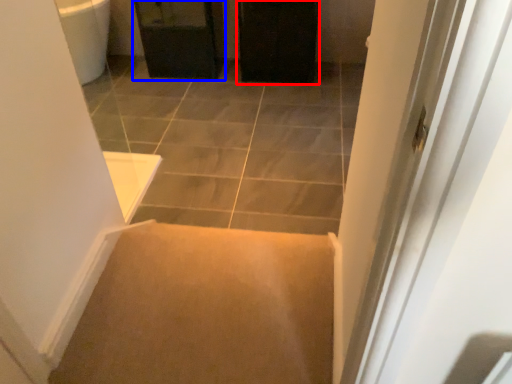
Question: Which point is further to the camera, screen door (highlighted by a red box) or cabinetry (highlighted by a blue box)?

Choices:
 (A) screen door
 (B) cabinetry

Answer: (B)